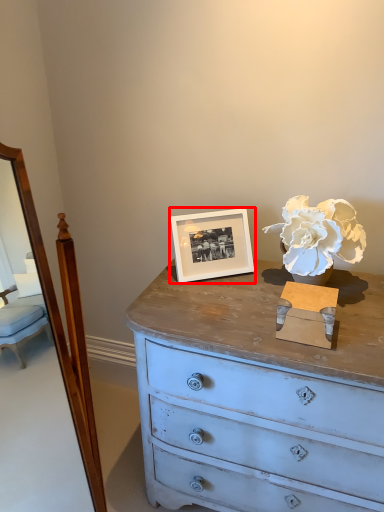
Question: Considering the relative positions of picture frame (annotated by the red box) and flower in the image provided, where is picture frame (annotated by the red box) located with respect to the staircase?

Choices:
 (A) left
 (B) right

Answer: (A)